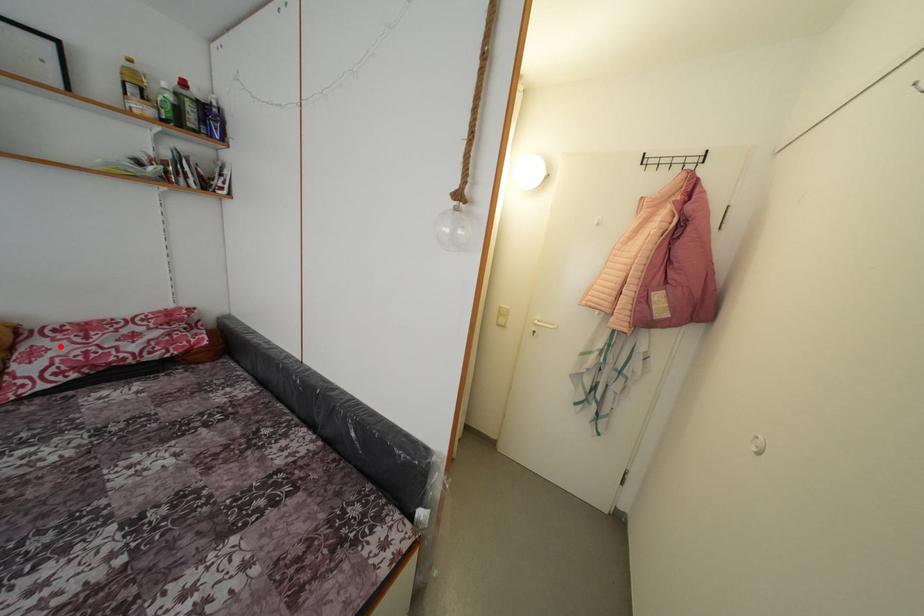
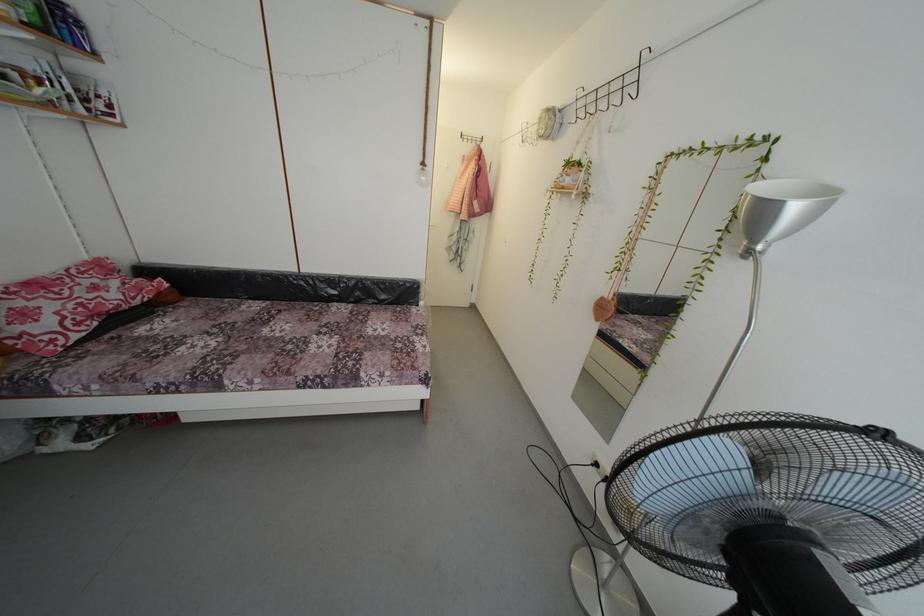
The point at the highlighted location is marked in the first image. Where is the corresponding point in the second image?

(34, 306)